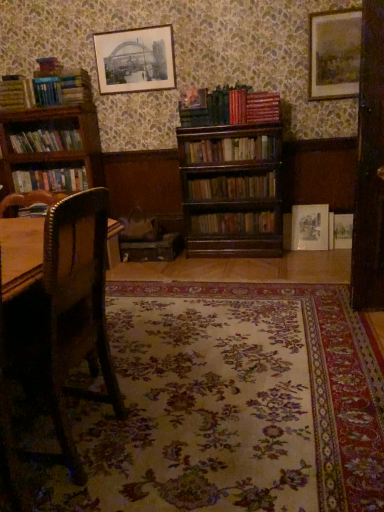
The image size is (384, 512). Identify the location of free space above wooden bookshelf at center, which is the 1th book in bottom-to-top order (from a real-world perspective). point(243,210).